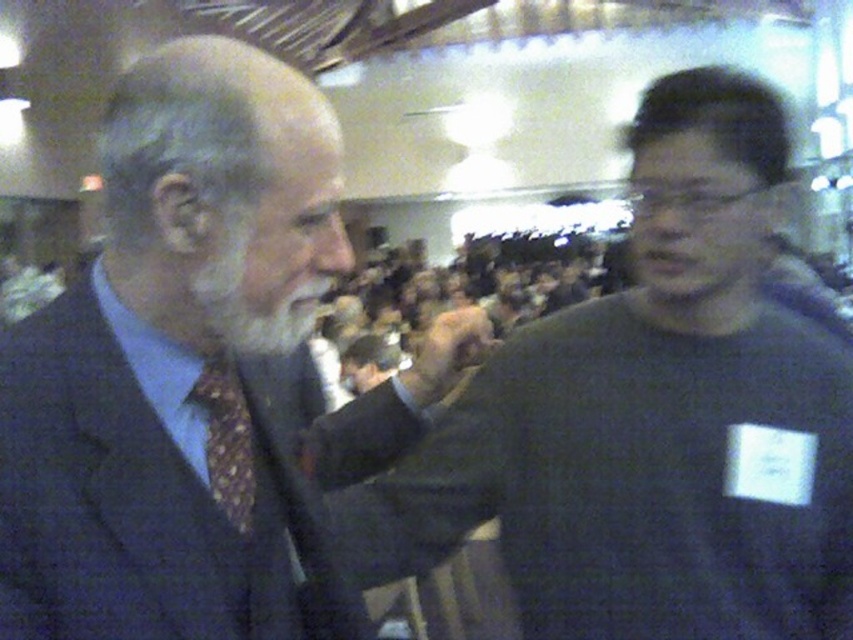
You are organizing a photo shoot and need to place a small microphone stand between the dark gray sweater at right and the white matte beard at left. Given that the stand requires at least 1 meter of space between its base and the nearest object, can you determine if there is enough space based on their widths?

The dark gray sweater at right is wider than the white matte beard at left. However, the provided information only mentions their widths relative to each other, not the actual distance between them. Without knowing the exact distance between the two objects, it is impossible to determine if the microphone stand can be placed safely.

You are a photographer at an event and notice the patterned silk tie at left and the matte black hand at center in your frame. To ensure both are visible in the photo, which object should you position closer to the top of the frame?

The matte black hand at center should be positioned closer to the top of the frame because the patterned silk tie at left is located below it.

You are a photographer at this event and want to ensure both the patterned silk tie at left and matte black hand at center are clearly visible in your photo. Given their sizes, which object should you focus on first to ensure sharpness?

The patterned silk tie at left has a smaller size compared to matte black hand at center, so you should focus on the smaller patterned silk tie at left first to ensure its details are sharp before adjusting for the larger matte black hand at center.